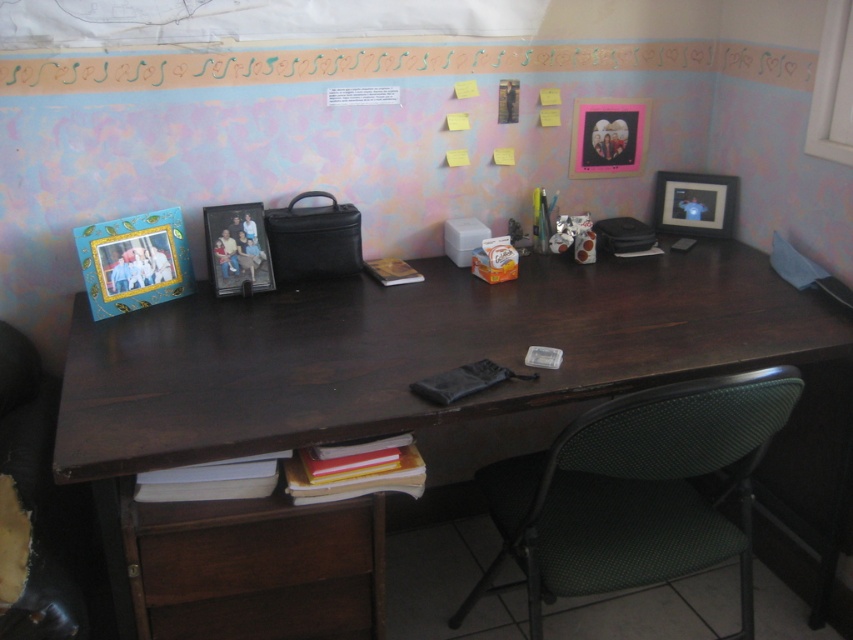
You are a person who is 1.7 meters tall. You want to sit on the green fabric swivel chair at lower right to work at the dark wood computer desk at center. Will your feet touch the floor?

The dark wood computer desk at center is much taller than the green fabric swivel chair at lower right. Since the desk is significantly taller, the chair might not be at a comfortable height for someone 1.7 meters tall, so their feet may not touch the floor comfortably.

You are organizing your desk and want to place a new item between the dark wood computer desk at center and the pink matte picture frame at upper right. Based on their positions, where should you place this item?

The dark wood computer desk at center is positioned under the pink matte picture frame at upper right, so placing the new item between them would require positioning it above the desk but below the frame.